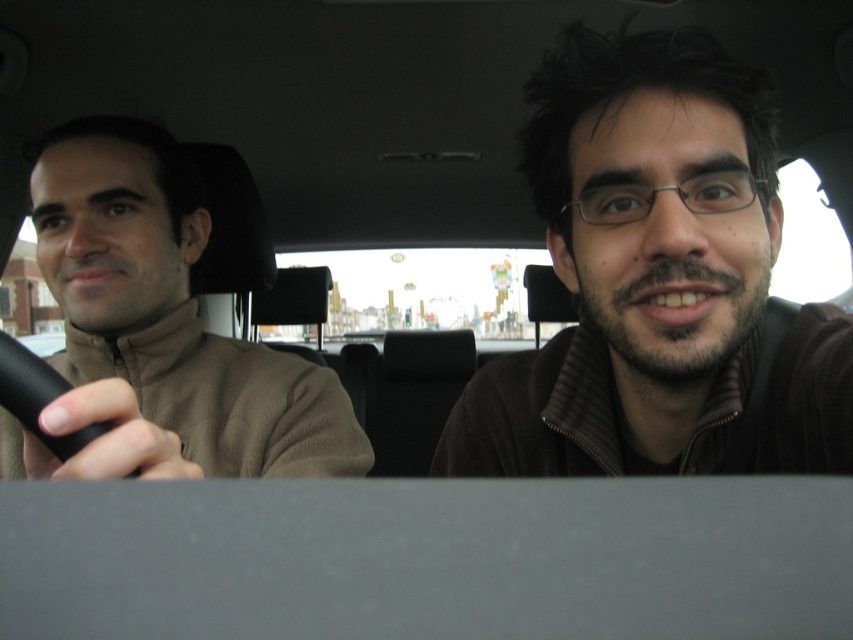
Question: Can you confirm if brown fuzzy sweater at upper right is positioned to the right of brown fleece at left?

Choices:
 (A) no
 (B) yes

Answer: (B)

Question: Which of the following is the farthest from the observer?

Choices:
 (A) brown fleece at left
 (B) brown fuzzy sweater at upper right

Answer: (B)

Question: In this image, where is brown fuzzy sweater at upper right located relative to brown fleece at left?

Choices:
 (A) left
 (B) right

Answer: (B)

Question: Is brown fuzzy sweater at upper right to the left of brown fleece at left from the viewer's perspective?

Choices:
 (A) no
 (B) yes

Answer: (A)